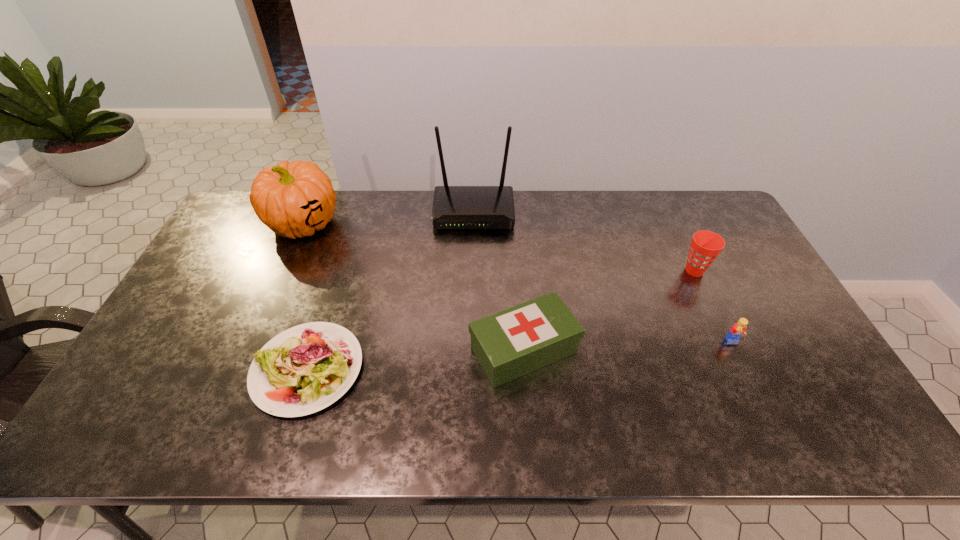
Where is `router`? router is located at coordinates (454, 207).

Identify the location of pumpkin. tap(295, 199).

The image size is (960, 540). In order to click on cup in this screenshot , I will do `click(705, 246)`.

Locate an element on the screen. Image resolution: width=960 pixels, height=540 pixels. the fourth shortest object is located at coordinates (705, 246).

The height and width of the screenshot is (540, 960). What are the coordinates of `the first-aid kit` in the screenshot? It's located at (509, 344).

At what (x,y) coordinates should I click in order to perform the action: click on the fifth tallest object. Please return your answer as a coordinate pair (x, y). The image size is (960, 540). Looking at the image, I should click on click(x=738, y=329).

What are the coordinates of `salad plate` in the screenshot? It's located at (304, 369).

Image resolution: width=960 pixels, height=540 pixels. In order to click on free space located on the front-facing side of the router in this screenshot , I will do `click(473, 255)`.

Where is `vacant point located on the surface of the pumpkin`? Image resolution: width=960 pixels, height=540 pixels. vacant point located on the surface of the pumpkin is located at coordinates (254, 335).

Where is `free location located 0.170m on the front of the fourth nearest object`? The width and height of the screenshot is (960, 540). free location located 0.170m on the front of the fourth nearest object is located at coordinates (721, 326).